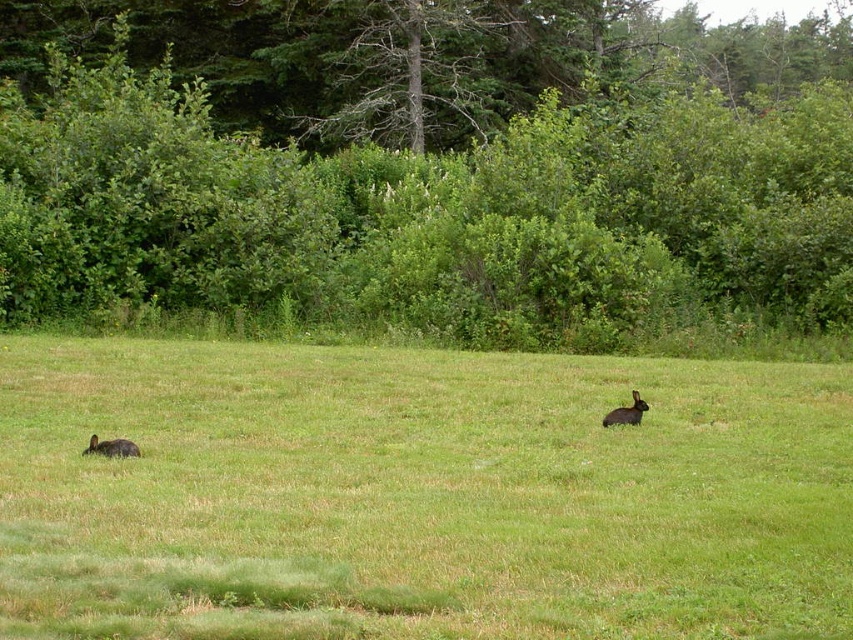
Does point (564, 444) lie in front of point (390, 4)?

Yes, point (564, 444) is closer to viewer.

Who is more forward, (x=70, y=512) or (x=490, y=13)?

Point (x=70, y=512)

Find the location of a particular element. green grassy field at center is located at coordinates (416, 493).

Who is lower down, green leafy tree at upper center or fuzzy brown rabbit at center-right?

Positioned lower is fuzzy brown rabbit at center-right.

Which is more to the right, green leafy tree at upper center or fuzzy brown rabbit at center-right?

fuzzy brown rabbit at center-right

Is point (418, 8) in front of point (634, 394)?

That is False.

What are the coordinates of `green leafy tree at upper center` in the screenshot? It's located at (410, 72).

Does green leafy bush at center have a greater width compared to green leafy tree at upper center?

Correct, the width of green leafy bush at center exceeds that of green leafy tree at upper center.

Can you confirm if green leafy bush at center is positioned to the left of green leafy tree at upper center?

No, green leafy bush at center is not to the left of green leafy tree at upper center.

Does point (648, 100) lie in front of point (372, 61)?

No, it is not.

This screenshot has width=853, height=640. I want to click on green leafy bush at center, so click(431, 168).